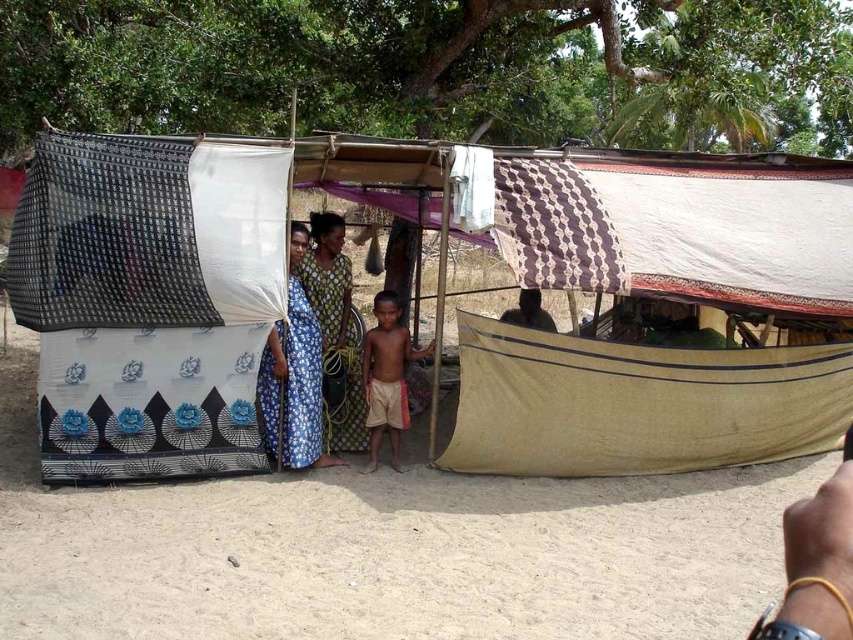
Question: Which object appears closest to the camera in this image?

Choices:
 (A) beige canvas tent at right
 (B) printed fabric dress at center

Answer: (A)

Question: Is the position of blue printed fabric dress at center more distant than that of tan cotton shorts at center?

Choices:
 (A) no
 (B) yes

Answer: (A)

Question: Among these points, which one is farthest from the camera?

Choices:
 (A) (491, 330)
 (B) (381, 358)

Answer: (B)

Question: Among these points, which one is farthest from the camera?

Choices:
 (A) (392, 176)
 (B) (381, 406)

Answer: (A)

Question: Is beige canvas tent at right wider than printed fabric dress at center?

Choices:
 (A) yes
 (B) no

Answer: (A)

Question: Is blue printed fabric dress at center closer to camera compared to printed fabric dress at center?

Choices:
 (A) yes
 (B) no

Answer: (A)